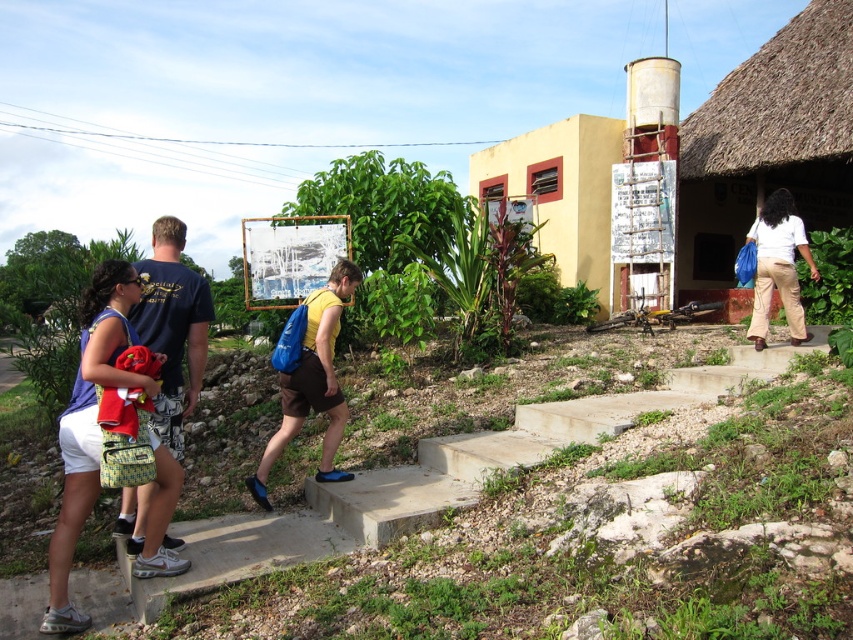
Is point (160, 429) behind point (328, 291)?

No, it is not.

Between point (169, 440) and point (299, 412), which one is positioned behind?

Point (299, 412)

The width and height of the screenshot is (853, 640). I want to click on matte blue t-shirt at left, so click(x=172, y=326).

Does point (161, 369) come closer to viewer compared to point (757, 228)?

Yes, point (161, 369) is in front of point (757, 228).

Is matte blue t-shirt at left to the left of white cotton shirt at right from the viewer's perspective?

Indeed, matte blue t-shirt at left is positioned on the left side of white cotton shirt at right.

Who is more distant from viewer, (200, 282) or (769, 305)?

The point (769, 305) is behind.

Where is `matte blue t-shirt at left`? matte blue t-shirt at left is located at coordinates (172, 326).

Consider the image. Is yellow matte building at upper center closer to camera compared to matte blue t-shirt at left?

That is False.

Is yellow matte building at upper center wider than matte blue t-shirt at left?

Yes, yellow matte building at upper center is wider than matte blue t-shirt at left.

This screenshot has width=853, height=640. In order to click on yellow matte building at upper center in this screenshot , I will do `click(560, 189)`.

Find the location of `yellow matte building at upper center`. yellow matte building at upper center is located at coordinates (560, 189).